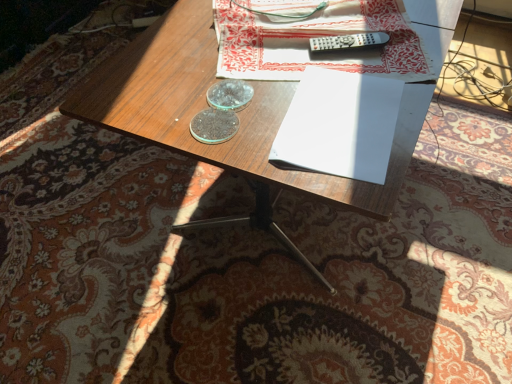
Locate an element on the screen. This screenshot has width=512, height=384. vacant area that lies between white paper at center and white paper at upper center is located at coordinates (287, 113).